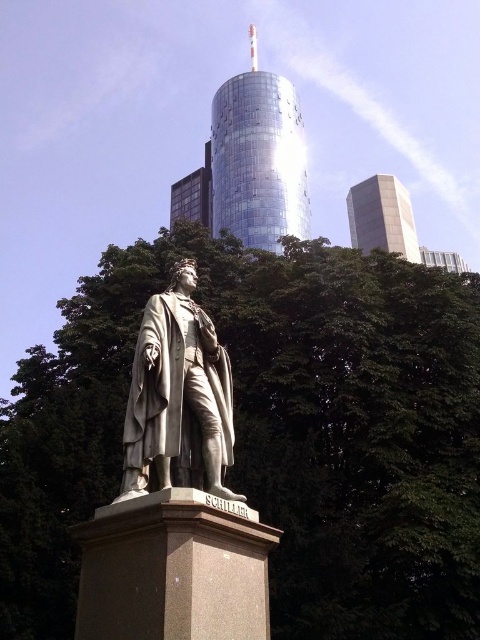
You are a city planner who wants to install a new bench in the park. You have two options for locations. One is near the green leafy tree at center, and the other is near the shiny glass tower at upper center. Which location offers more shade during the afternoon? Please explain your reasoning based on the objects in the scene.

The green leafy tree at center is smaller than the shiny glass tower at upper center. Since trees provide shade through their leaves and branches, the smaller tree may cast a smaller shadow area. However, the shiny glass tower at upper center, being larger, might cast a broader shadow. However, the tower is at upper center and made of reflective glass, which might not block sunlight effectively. Therefore, the green leafy tree at center is more likely to provide better shade because trees are designed to.

You are standing in the public square and want to take a photo of the gray stone statue at center without the green leafy tree at center blocking the view. Which direction should you move to achieve this?

Move away from the gray stone statue at center towards the green leafy tree at center. Since the green leafy tree at center is closer to you than the gray stone statue at center, moving towards the tree will place it between you and the statue, but to avoid the tree blocking the statue, you should move in the opposite direction, away from the tree and closer to the statue. Wait, this is conflicting. Let me think again. If the tree is closer to the viewer than the statue, then to avoid the tree blocking the

You are standing in the public square and want to take a photo of the statue of Friedrich Schiller. There are two points marked on the ground where you can stand to take the photo. The first point is at coordinates point (93, 456) and the second is at point (223, 115). Which point will give you a better view of the statue without any obstructions from the modern skyscraper in the background?

Point (93, 456) is in front of point (223, 115). Therefore, standing at point (93, 456) will place you closer to the statue and farther from the skyscraper, providing a clearer view without obstruction.